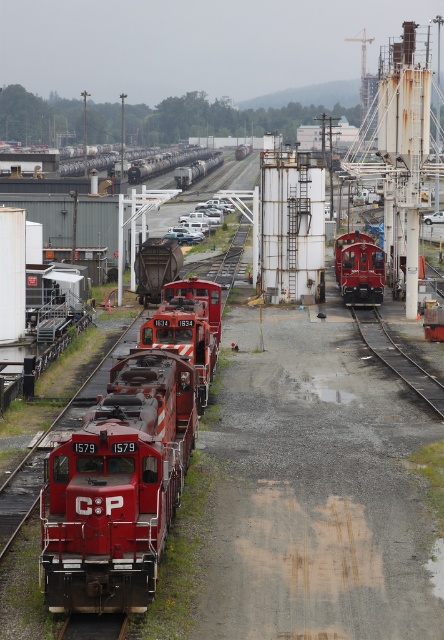
Between matte red locomotive at left and smooth metal train track at lower right, which one has more height?

matte red locomotive at left is taller.

Does matte red locomotive at left have a greater height compared to smooth metal train track at lower right?

Indeed, matte red locomotive at left has a greater height compared to smooth metal train track at lower right.

Between point (166, 508) and point (440, 406), which one is positioned behind?

Point (440, 406)

Identify the location of matte red locomotive at left. The height and width of the screenshot is (640, 444). (127, 467).

Is matte red locomotive at left closer to the viewer compared to matte red train at center?

Yes, matte red locomotive at left is closer to the viewer.

Describe the element at coordinates (127, 467) in the screenshot. I see `matte red locomotive at left` at that location.

Which is in front, point (135, 371) or point (190, 323)?

Point (135, 371) is in front.

At what (x,y) coordinates should I click in order to perform the action: click on matte red locomotive at left. Please return your answer as a coordinate pair (x, y). The height and width of the screenshot is (640, 444). Looking at the image, I should click on (127, 467).

Is matte red train at center shorter than smooth metal train track at lower right?

Incorrect, matte red train at center's height does not fall short of smooth metal train track at lower right's.

Who is more distant from viewer, (214, 289) or (428, 388)?

The point (214, 289) is behind.

Locate an element on the screen. matte red train at center is located at coordinates (187, 326).